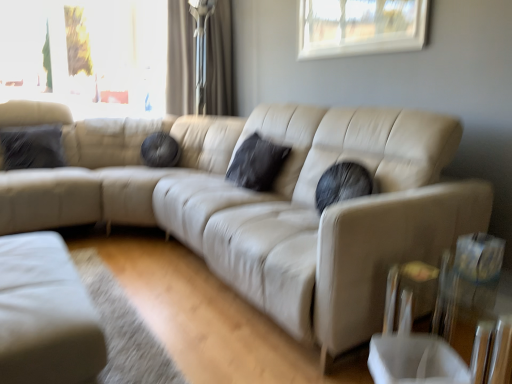
Question: From a real-world perspective, is black matte pillow at center, the 2th pillow positioned from the left, above or below velvet dark gray pillow at left, which is the 2th pillow from right to left?

Choices:
 (A) above
 (B) below

Answer: (A)

Question: Considering the positions of point (267, 158) and point (53, 135), is point (267, 158) closer or farther from the camera than point (53, 135)?

Choices:
 (A) closer
 (B) farther

Answer: (A)

Question: Considering the real-world distances, which object is farthest from the transparent glass table at lower right?

Choices:
 (A) velvet dark gray pillow at left, which is the 2th pillow from right to left
 (B) matte beige curtain at upper center
 (C) black matte pillow at center, the 1th pillow positioned from the right
 (D) beige leather couch at center
 (E) transparent glass window at upper center

Answer: (B)

Question: Based on their relative distances, which object is farther from the transparent glass table at lower right?

Choices:
 (A) transparent glass window at upper center
 (B) velvet dark gray pillow at left, which is the 2th pillow from right to left
 (C) black matte pillow at center, the 1th pillow positioned from the right
 (D) matte beige curtain at upper center
 (E) beige leather couch at center

Answer: (D)